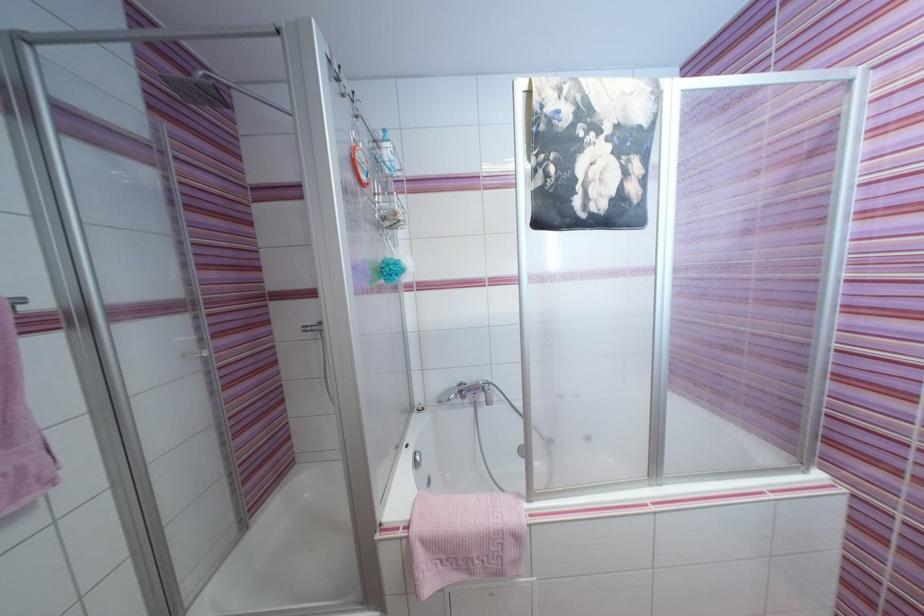
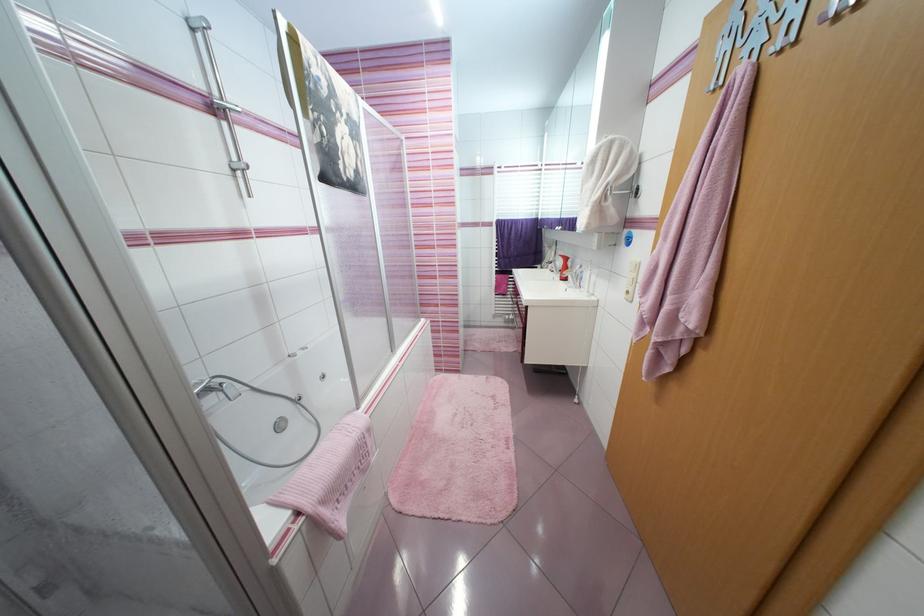
Question: Based on the continuous images, in which direction is the camera rotating? Reply with the corresponding letter.

Choices:
 (A) Left
 (B) Right
 (C) Up
 (D) Down

Answer: (B)